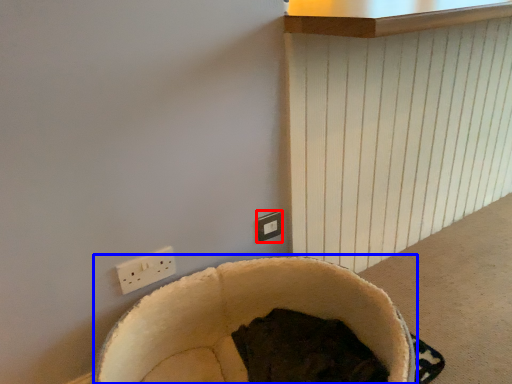
Question: Which of the following is the farthest to the observer, electric outlet (highlighted by a red box) or bean bag chair (highlighted by a blue box)?

Choices:
 (A) electric outlet
 (B) bean bag chair

Answer: (A)